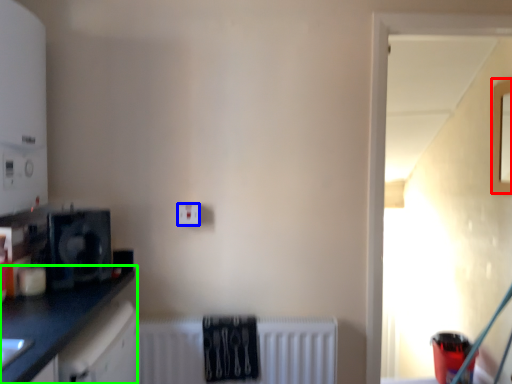
Question: Considering the real-world distances, which object is farthest from window (highlighted by a red box)? electric outlet (highlighted by a blue box) or countertop (highlighted by a green box)?

Choices:
 (A) electric outlet
 (B) countertop

Answer: (B)